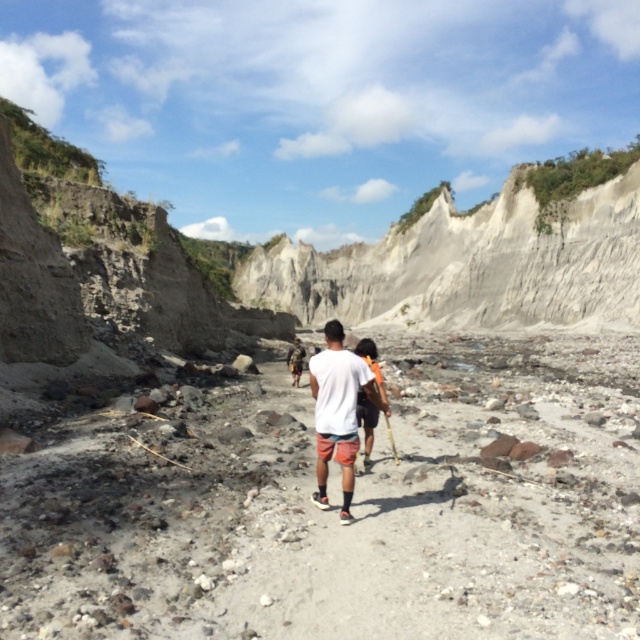
You are navigating a rocky desert landscape and see a gray gravel trail at center. According to the coordinates provided, is the trail located closer to the top or bottom of the image?

The gray gravel trail at center is located at coordinates point (339, 506). Since the y coordinate is 0.530, which is slightly above the center point of 0.5, the trail is closer to the bottom of the image.

You are planning to hike along the gray gravel trail at center while wearing the white matte shirt at center. Considering their heights, will the trail be visible above or below the shirt?

The gray gravel trail at center has a lesser height compared to the white matte shirt at center, so the trail will be visible below the shirt.